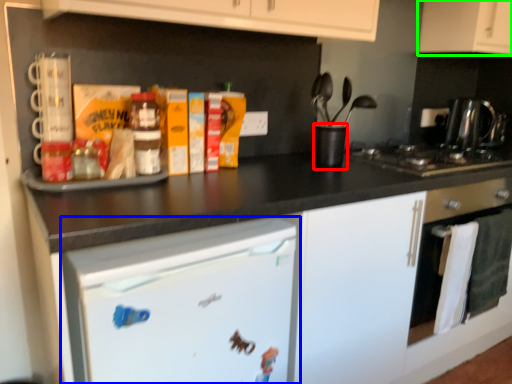
Question: Which object is positioned closest to appliance (highlighted by a red box)? Select from home appliance (highlighted by a blue box) and cabinetry (highlighted by a green box).

Choices:
 (A) home appliance
 (B) cabinetry

Answer: (A)